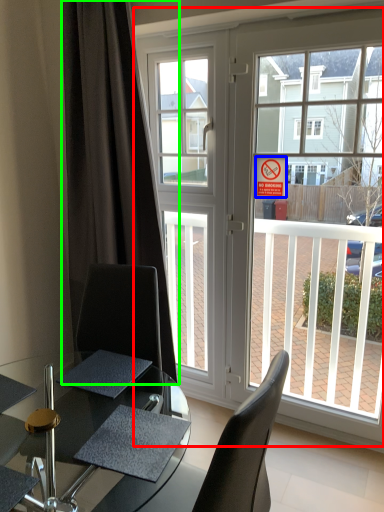
Question: Which is nearer to the window (highlighted by a red box)? parking sign (highlighted by a blue box) or curtain (highlighted by a green box).

Choices:
 (A) parking sign
 (B) curtain

Answer: (B)